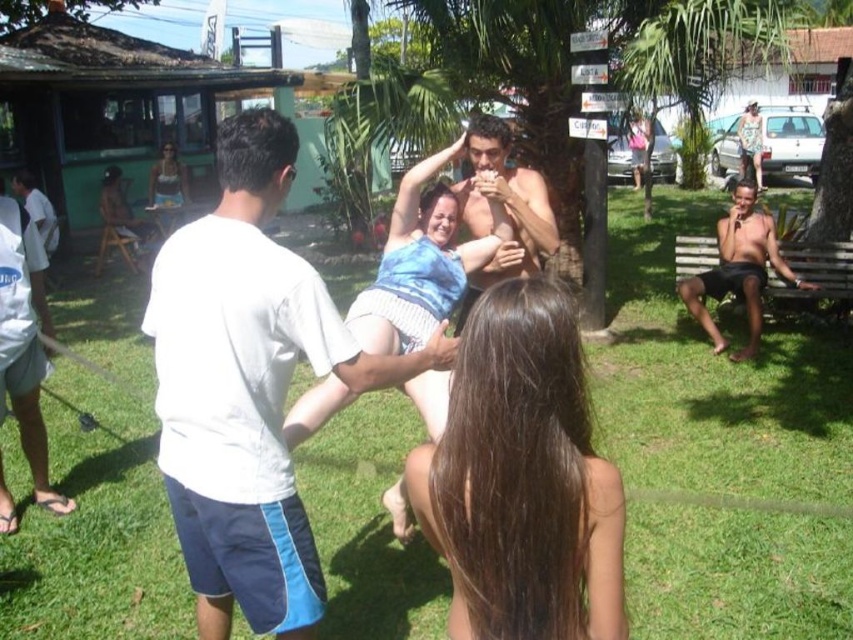
Image resolution: width=853 pixels, height=640 pixels. What do you see at coordinates (721, 451) in the screenshot? I see `green grass at center` at bounding box center [721, 451].

Can you confirm if green grass at center is taller than tan skin man at right?

Indeed, green grass at center has a greater height compared to tan skin man at right.

Who is more forward, (811, 593) or (756, 316)?

Point (811, 593) is more forward.

Find the location of `green grass at center`. green grass at center is located at coordinates (721, 451).

Does green leafy palm tree at upper center have a smaller size compared to blue tie-dye bikini top at center?

Correct, green leafy palm tree at upper center occupies less space than blue tie-dye bikini top at center.

Find the location of a particular element. green leafy palm tree at upper center is located at coordinates (701, 49).

Locate an element on the screen. This screenshot has width=853, height=640. green leafy palm tree at upper center is located at coordinates [x=701, y=49].

Looking at this image, between tan skin man at right and blue tie-dye bikini top at center, which one is positioned higher?

blue tie-dye bikini top at center is above.

Between point (685, 305) and point (740, 138), which one is positioned in front?

Point (685, 305)

Describe the element at coordinates (740, 269) in the screenshot. I see `tan skin man at right` at that location.

I want to click on tan skin man at right, so click(x=740, y=269).